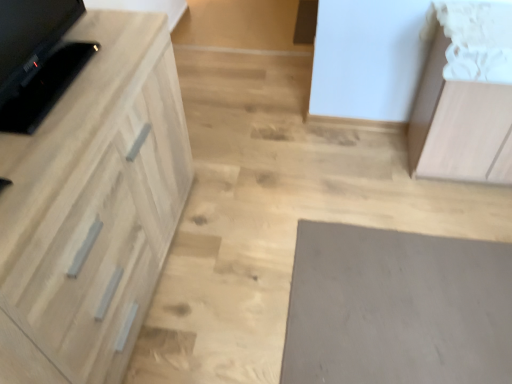
At what (x,y) coordinates should I click in order to perform the action: click on vacant space in gray matte mat at lower right (from a real-world perspective). Please return your answer as a coordinate pair (x, y). This screenshot has height=384, width=512. Looking at the image, I should click on (409, 307).